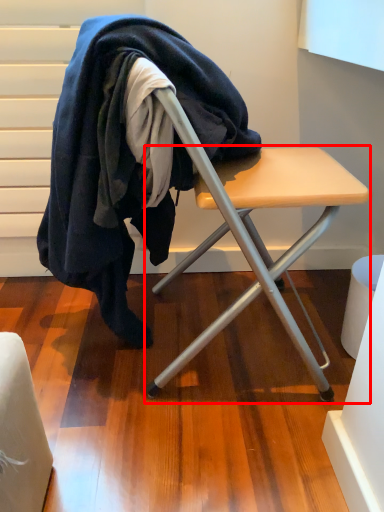
Question: Considering the relative positions of table (annotated by the red box) and wool in the image provided, where is table (annotated by the red box) located with respect to the staircase?

Choices:
 (A) right
 (B) left

Answer: (A)